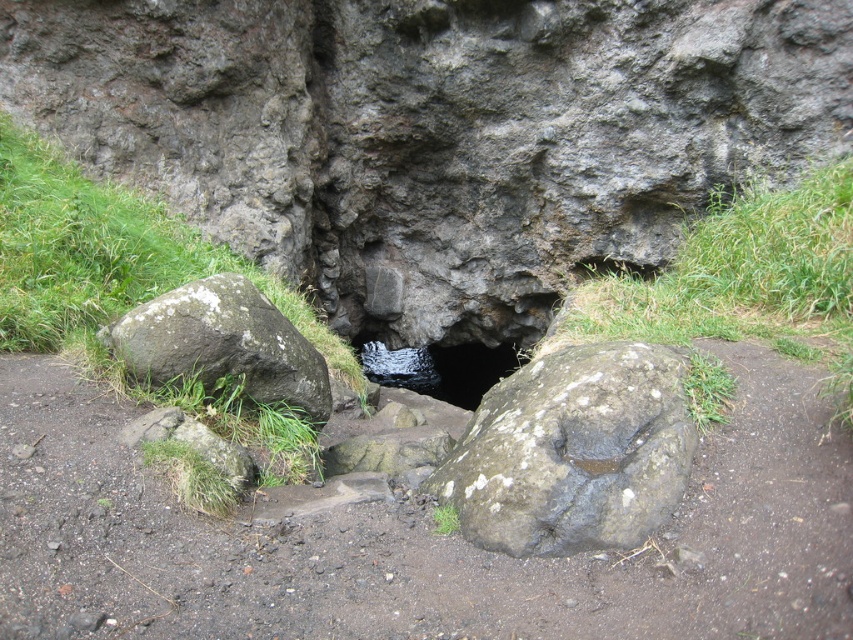
You are a hiker carrying a 10 meter long rope. You need to cross from the gray rough rock at left to the black rock hole at center. Can you use the rope to make a bridge between them?

The gray rough rock at left is 9.60 meters from the black rock hole at center. Since the rope is 10 meters long, it is slightly longer than the distance between them, so yes, you can use the rope to make a bridge between the gray rough rock at left and the black rock hole at center.

You are standing at the cave entrance and want to place a small marker at both point (270, 355) and point (502, 360). Which point should you reach first without moving your feet?

You should reach point (270, 355) first because it is closer to you than point (502, 360).